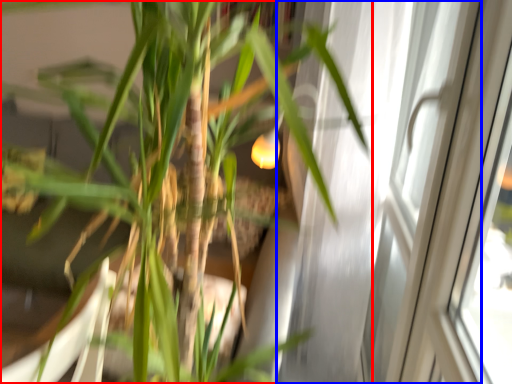
Question: Which object appears farthest to the camera in this image, houseplant (highlighted by a red box) or screen door (highlighted by a blue box)?

Choices:
 (A) houseplant
 (B) screen door

Answer: (B)